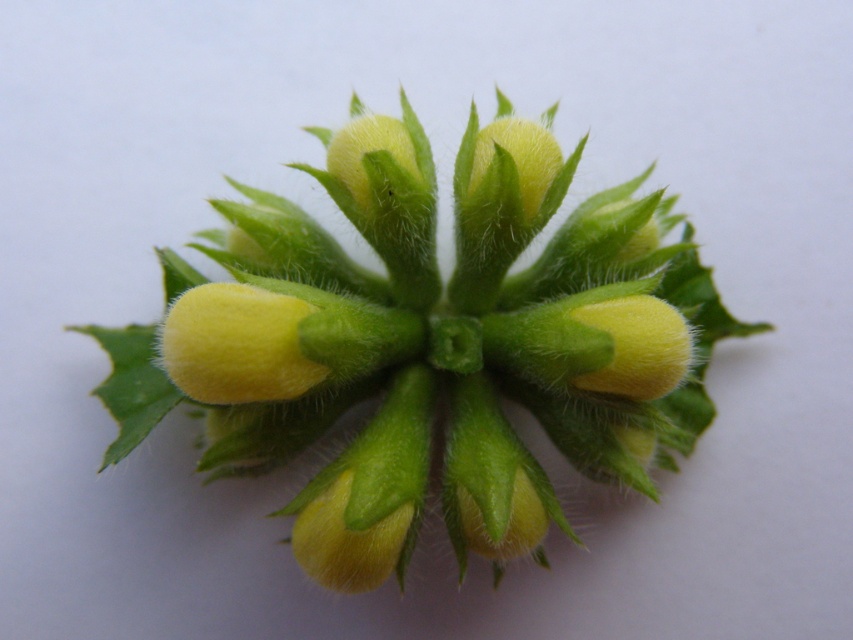
Can you confirm if fuzzy yellow buds at center is smaller than yellow fuzzy flower at center?

No.

Is fuzzy yellow buds at center below yellow fuzzy flower at center?

No.

Find the location of a particular element. fuzzy yellow buds at center is located at coordinates (430, 342).

This screenshot has width=853, height=640. In order to click on fuzzy yellow buds at center in this screenshot , I will do `click(430, 342)`.